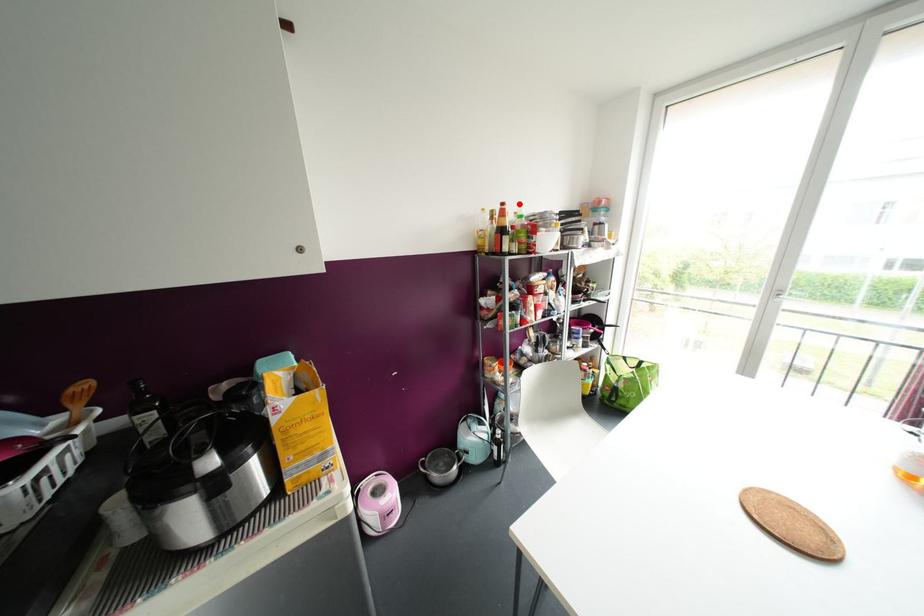
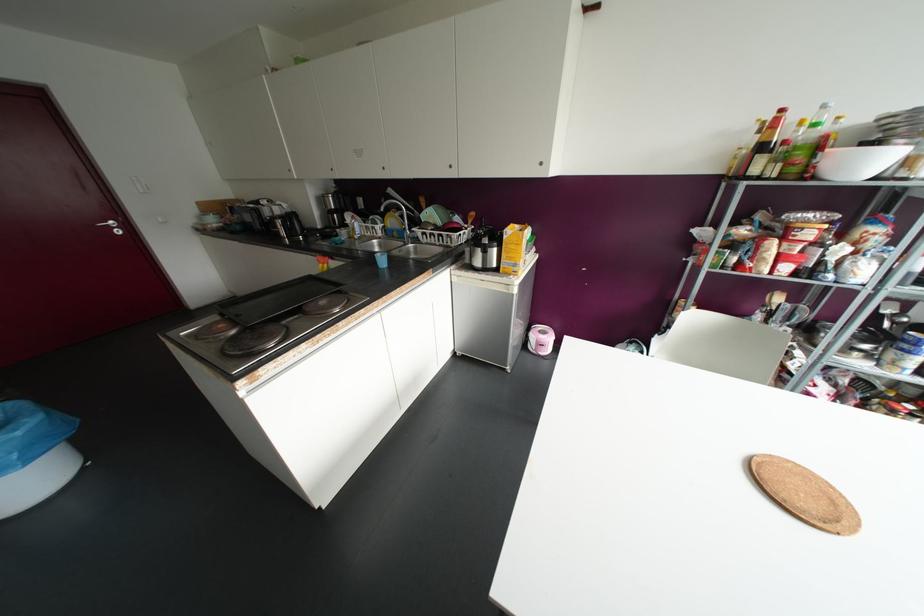
The point at the highlighted location is marked in the first image. Where is the corresponding point in the second image?

(823, 106)